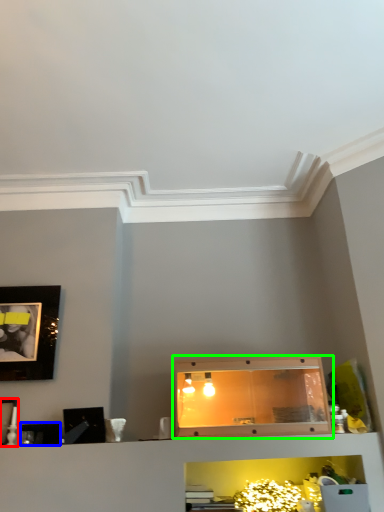
Question: Considering the real-world distances, which object is farthest from picture frame (highlighted by a red box)? picture frame (highlighted by a blue box) or cabinetry (highlighted by a green box)?

Choices:
 (A) picture frame
 (B) cabinetry

Answer: (B)